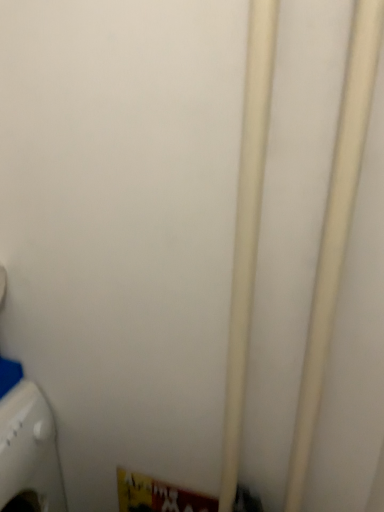
Question: Is white plastic washing machine at lower left shorter than white matte pipe at center, the first pipe positioned from the left?

Choices:
 (A) no
 (B) yes

Answer: (B)

Question: Is the depth of white plastic washing machine at lower left less than that of white matte pipe at center, the first pipe positioned from the left?

Choices:
 (A) no
 (B) yes

Answer: (A)

Question: From a real-world perspective, does white plastic washing machine at lower left sit lower than white matte pipe at center, the first pipe positioned from the left?

Choices:
 (A) yes
 (B) no

Answer: (A)

Question: Is white plastic washing machine at lower left at the right side of white matte pipe at center, the 2th pipe viewed from the right?

Choices:
 (A) no
 (B) yes

Answer: (A)

Question: Is white plastic washing machine at lower left wider than white matte pipe at center, the 2th pipe viewed from the right?

Choices:
 (A) no
 (B) yes

Answer: (B)

Question: Could you tell me if white plastic washing machine at lower left is facing white matte pipe at center, the first pipe positioned from the left?

Choices:
 (A) no
 (B) yes

Answer: (A)

Question: Would you consider white matte pipe at center, the 2th pipe viewed from the right, to be distant from white plastic washing machine at lower left?

Choices:
 (A) yes
 (B) no

Answer: (B)

Question: Would you say white plastic washing machine at lower left is part of white matte pipe at center, the first pipe positioned from the left,'s contents?

Choices:
 (A) no
 (B) yes

Answer: (A)

Question: Can you confirm if white matte pipe at center, the first pipe positioned from the left, is bigger than white plastic washing machine at lower left?

Choices:
 (A) yes
 (B) no

Answer: (B)

Question: Is white matte pipe at center, the first pipe positioned from the left, positioned behind white plastic washing machine at lower left?

Choices:
 (A) yes
 (B) no

Answer: (B)

Question: Is white matte pipe at center, the 2th pipe viewed from the right, shorter than white plastic washing machine at lower left?

Choices:
 (A) no
 (B) yes

Answer: (A)

Question: Is white matte pipe at center, the 2th pipe viewed from the right, at the left side of white plastic washing machine at lower left?

Choices:
 (A) no
 (B) yes

Answer: (A)

Question: Does white matte pipe at center, which is the second pipe in left-to-right order, appear on the left side of white matte pipe at center, the first pipe positioned from the left?

Choices:
 (A) yes
 (B) no

Answer: (B)